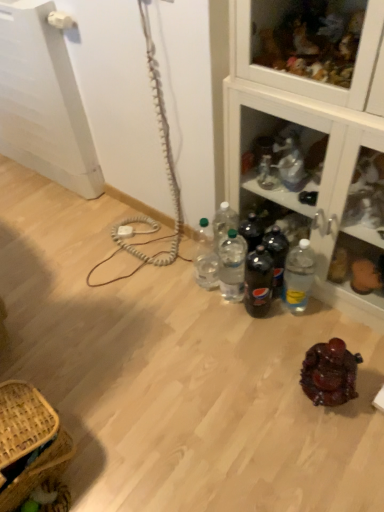
Identify the location of vacant area that lies between clear plastic bottles at center, marked as the second bottle in a left-to-right arrangement, and shiny brown candy at center. (274, 342).